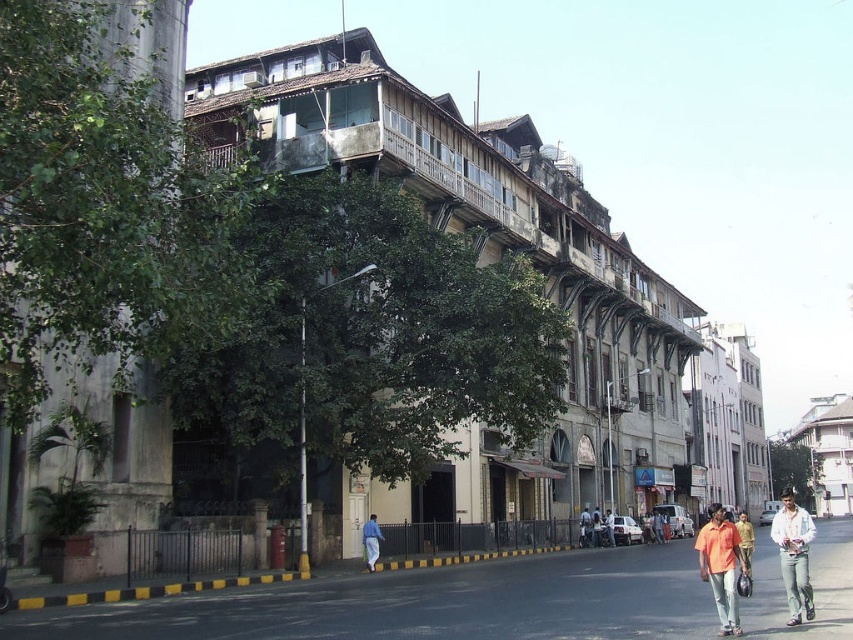
Does orange cotton shirt at lower right appear over white cotton shirt at lower right?

Indeed, orange cotton shirt at lower right is positioned over white cotton shirt at lower right.

Does orange cotton shirt at lower right have a smaller size compared to white cotton shirt at lower right?

Indeed, orange cotton shirt at lower right has a smaller size compared to white cotton shirt at lower right.

Measure the distance between orange cotton shirt at lower right and camera.

orange cotton shirt at lower right is 38.01 meters away from camera.

Where is `orange cotton shirt at lower right`? The height and width of the screenshot is (640, 853). orange cotton shirt at lower right is located at coordinates (721, 566).

Can you confirm if white cotton shirt at lower right is thinner than blue jeans at lower center?

In fact, white cotton shirt at lower right might be wider than blue jeans at lower center.

The width and height of the screenshot is (853, 640). I want to click on white cotton shirt at lower right, so click(793, 556).

Identify the location of white cotton shirt at lower right. The width and height of the screenshot is (853, 640). (793, 556).

Between orange shirt at center and light orange shirt at center, which one appears on the left side from the viewer's perspective?

orange shirt at center

Which is below, orange shirt at center or light orange shirt at center?

Positioned lower is light orange shirt at center.

Is point (596, 534) more distant than point (602, 522)?

No.

This screenshot has width=853, height=640. I want to click on orange shirt at center, so click(x=596, y=528).